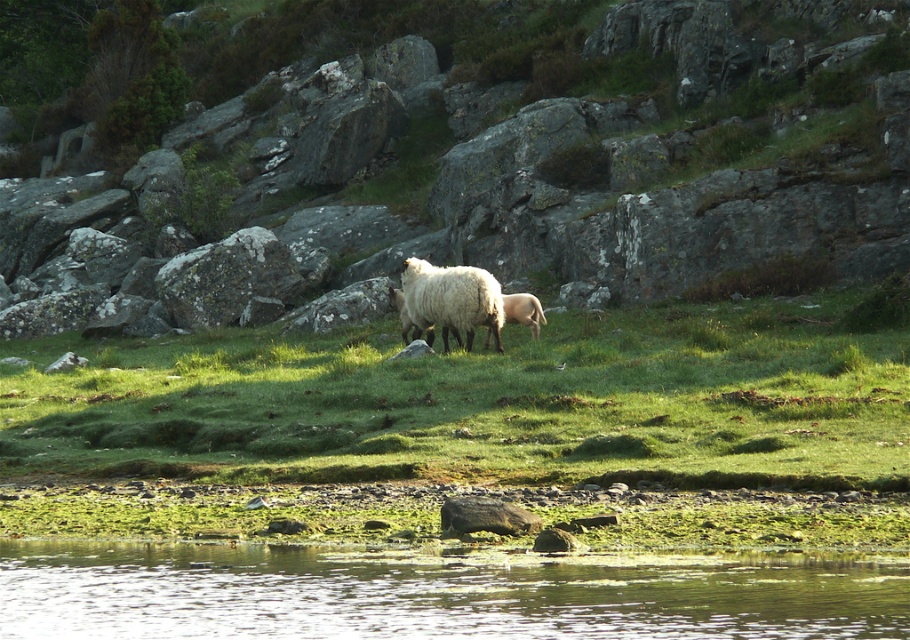
Question: Which of the following is the farthest from the observer?

Choices:
 (A) (453, 312)
 (B) (264, 268)

Answer: (B)

Question: Which object is positioned farthest from the green grassy hillside at center?

Choices:
 (A) green grassy at center
 (B) clear water at lower center
 (C) gray rock at center

Answer: (B)

Question: Is green grassy at center to the left of clear water at lower center from the viewer's perspective?

Choices:
 (A) no
 (B) yes

Answer: (B)

Question: Can you confirm if gray rock at center is wider than white woolly lamb at center?

Choices:
 (A) no
 (B) yes

Answer: (B)

Question: Can you confirm if green grassy hillside at center is positioned below white woolly sheep at center?

Choices:
 (A) yes
 (B) no

Answer: (B)

Question: Which of the following is the closest to the observer?

Choices:
 (A) (259, 250)
 (B) (480, 556)
 (C) (295, 381)
 (D) (534, 312)

Answer: (B)